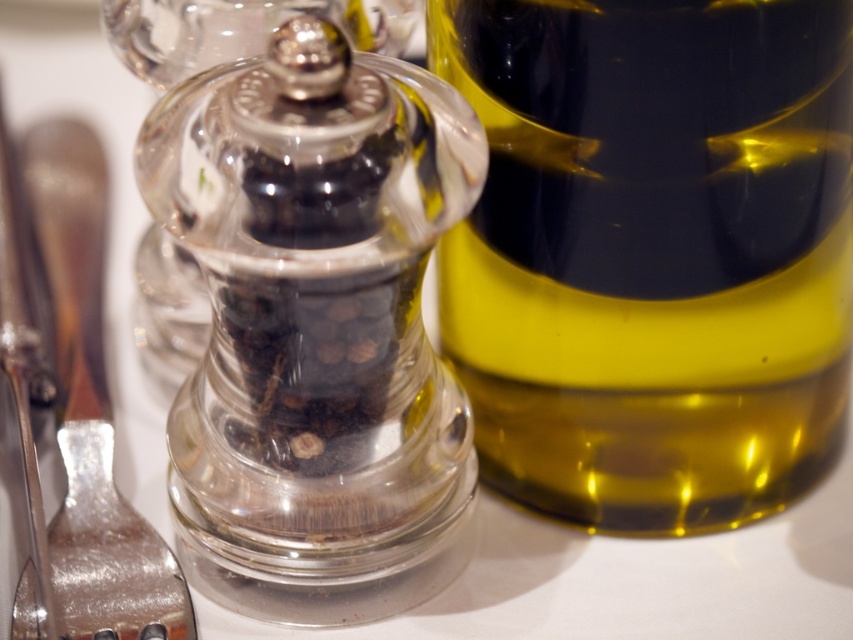
Is transparent glass pepper mill at center behind transparent glass pepper grinder at center?

No, it is not.

The image size is (853, 640). What do you see at coordinates (315, 328) in the screenshot? I see `transparent glass pepper mill at center` at bounding box center [315, 328].

Where is `transparent glass pepper mill at center`? This screenshot has width=853, height=640. transparent glass pepper mill at center is located at coordinates (315, 328).

Where is `transparent glass pepper mill at center`? Image resolution: width=853 pixels, height=640 pixels. transparent glass pepper mill at center is located at coordinates (315, 328).

Can you confirm if yellow translucent bottle at right is bigger than transparent glass pepper mill at center?

Indeed, yellow translucent bottle at right has a larger size compared to transparent glass pepper mill at center.

Does yellow translucent bottle at right have a smaller size compared to transparent glass pepper mill at center?

Incorrect, yellow translucent bottle at right is not smaller in size than transparent glass pepper mill at center.

Where is `yellow translucent bottle at right`? yellow translucent bottle at right is located at coordinates (653, 252).

Is point (67, 394) positioned in front of point (135, 340)?

Yes, point (67, 394) is in front of point (135, 340).

Which is in front, point (100, 172) or point (171, 237)?

Point (171, 237) is more forward.

The height and width of the screenshot is (640, 853). I want to click on shiny metallic fork at left, so click(86, 397).